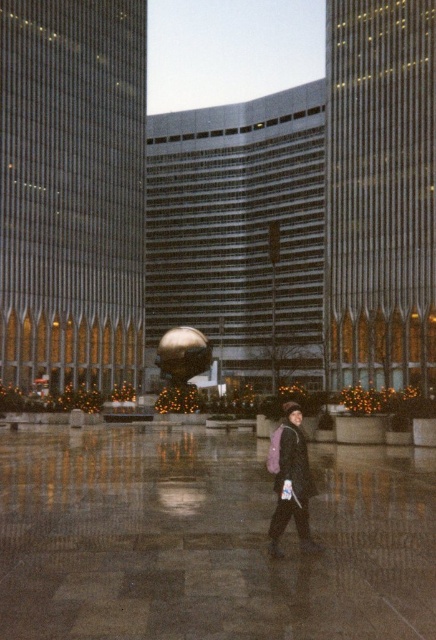
Question: Can you confirm if polished stone pavement at center is thinner than dark gray woolen coat at center?

Choices:
 (A) yes
 (B) no

Answer: (B)

Question: Which of the following is the closest to the observer?

Choices:
 (A) [389, 538]
 (B) [309, 541]

Answer: (B)

Question: Which object appears closest to the camera in this image?

Choices:
 (A) dark gray woolen coat at center
 (B) polished stone pavement at center

Answer: (B)

Question: Which point is farther to the camera?

Choices:
 (A) polished stone pavement at center
 (B) dark gray woolen coat at center

Answer: (B)

Question: Can you confirm if polished stone pavement at center is positioned below dark gray woolen coat at center?

Choices:
 (A) no
 (B) yes

Answer: (B)

Question: Is the position of polished stone pavement at center less distant than that of dark gray woolen coat at center?

Choices:
 (A) yes
 (B) no

Answer: (A)